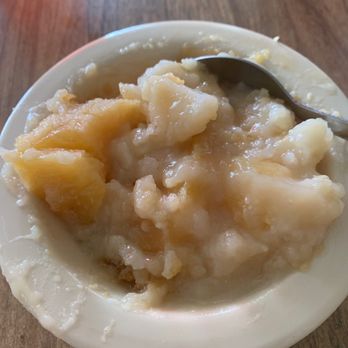
Locate an element on the screen. The width and height of the screenshot is (348, 348). plate is located at coordinates (286, 316).